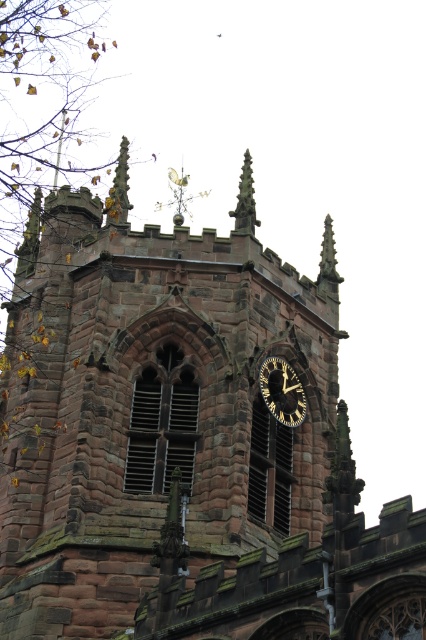
Can you confirm if gold/black clock at center is shorter than smooth stone spire at upper center?

Yes.

Between gold/black clock at center and smooth stone spire at upper center, which one has less height?

gold/black clock at center

Is point (296, 426) positioned behind point (238, 228)?

No, (296, 426) is closer to viewer.

Where is `gold/black clock at center`? gold/black clock at center is located at coordinates (282, 392).